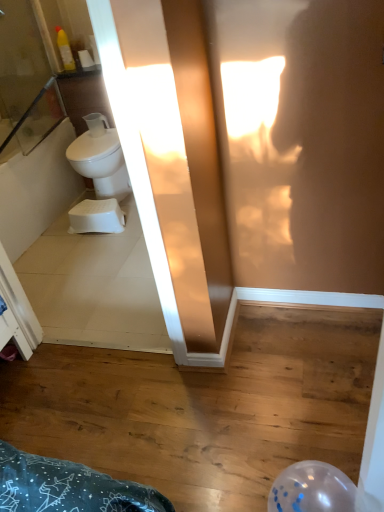
Question: Can you confirm if white glossy toilet at left is smaller than white matte toilet paper at upper left?

Choices:
 (A) no
 (B) yes

Answer: (A)

Question: Does white glossy toilet at left have a larger size compared to white matte toilet paper at upper left?

Choices:
 (A) yes
 (B) no

Answer: (A)

Question: Is white glossy toilet at left taller than white matte toilet paper at upper left?

Choices:
 (A) no
 (B) yes

Answer: (B)

Question: Considering the relative positions of white glossy toilet at left and white matte toilet paper at upper left in the image provided, is white glossy toilet at left to the left of white matte toilet paper at upper left from the viewer's perspective?

Choices:
 (A) no
 (B) yes

Answer: (A)

Question: Is white matte toilet paper at upper left at the back of white glossy toilet at left?

Choices:
 (A) no
 (B) yes

Answer: (A)

Question: Would you say white plastic step stool at lower left is to the left or to the right of clear glass screen door at upper left in the picture?

Choices:
 (A) right
 (B) left

Answer: (A)

Question: Based on their sizes in the image, would you say white plastic step stool at lower left is bigger or smaller than clear glass screen door at upper left?

Choices:
 (A) small
 (B) big

Answer: (A)

Question: Is white plastic step stool at lower left taller or shorter than clear glass screen door at upper left?

Choices:
 (A) tall
 (B) short

Answer: (B)

Question: From a real-world perspective, is white plastic step stool at lower left physically located above or below clear glass screen door at upper left?

Choices:
 (A) above
 (B) below

Answer: (B)

Question: Relative to white glossy toilet at left, is white matte toilet paper at upper left in front or behind?

Choices:
 (A) behind
 (B) front

Answer: (A)

Question: In terms of width, does white matte toilet paper at upper left look wider or thinner when compared to white glossy toilet at left?

Choices:
 (A) thin
 (B) wide

Answer: (A)

Question: Is white matte toilet paper at upper left taller or shorter than white glossy toilet at left?

Choices:
 (A) tall
 (B) short

Answer: (B)

Question: From the image's perspective, is white matte toilet paper at upper left positioned above or below white glossy toilet at left?

Choices:
 (A) above
 (B) below

Answer: (A)

Question: From a real-world perspective, is white matte toilet paper at upper left physically located above or below white plastic step stool at lower left?

Choices:
 (A) below
 (B) above

Answer: (B)

Question: Does point (89, 68) appear closer or farther from the camera than point (122, 229)?

Choices:
 (A) farther
 (B) closer

Answer: (A)